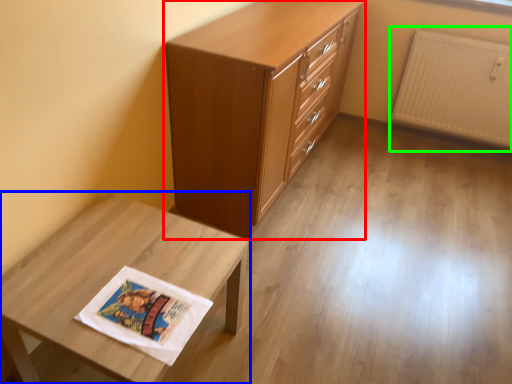
Question: Which object is the farthest from chest of drawers (highlighted by a red box)? Choose among these: table (highlighted by a blue box) or radiator (highlighted by a green box).

Choices:
 (A) table
 (B) radiator

Answer: (B)